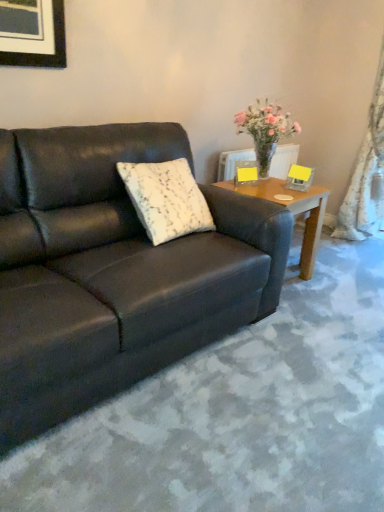
Identify the location of wooden side table at right. (292, 212).

From the picture: From the image's perspective, between white textured pillow at center and wooden side table at right, which one is located above?

white textured pillow at center is shown above in the image.

Is white textured pillow at center not near wooden side table at right?

No.

Is white textured pillow at center behind wooden side table at right?

No, white textured pillow at center is closer to the camera.

Find the location of a particular element. Image resolution: width=384 pixels, height=512 pixels. pillow behind the matte black couch at center is located at coordinates (166, 199).

How many degrees apart are the facing directions of matte black couch at center and white textured pillow at center?

The angular difference between matte black couch at center and white textured pillow at center is 1.56 degrees.

Considering the sizes of matte black couch at center and white textured pillow at center in the image, is matte black couch at center taller or shorter than white textured pillow at center?

Considering their sizes, matte black couch at center has more height than white textured pillow at center.

Is matte black couch at center surrounding white textured pillow at center?

Yes, white textured pillow at center can be found within matte black couch at center.

Measure the distance from matte black couch at center to white lace curtain at right.

matte black couch at center is 2.06 meters from white lace curtain at right.

What's the angular difference between matte black couch at center and white lace curtain at right's facing directions?

The facing directions of matte black couch at center and white lace curtain at right are 89.5 degrees apart.

Considering the sizes of objects matte black couch at center and white lace curtain at right in the image provided, who is wider, matte black couch at center or white lace curtain at right?

matte black couch at center.

Does matte black couch at center have a lesser height compared to white lace curtain at right?

Indeed, matte black couch at center has a lesser height compared to white lace curtain at right.

Which point is more distant from viewer, (198, 238) or (246, 131)?

The point (246, 131) is more distant.

Considering the relative sizes of matte black couch at center and translucent glass vase at upper right in the image provided, is matte black couch at center smaller than translucent glass vase at upper right?

No, matte black couch at center is not smaller than translucent glass vase at upper right.

Does matte black couch at center touch translucent glass vase at upper right?

No, matte black couch at center is not in contact with translucent glass vase at upper right.

Considering the positions of objects matte black couch at center and translucent glass vase at upper right in the image provided, who is more to the right, matte black couch at center or translucent glass vase at upper right?

translucent glass vase at upper right is more to the right.

Is white lace curtain at right positioned beyond the bounds of translucent glass vase at upper right?

Yes, white lace curtain at right is located beyond the bounds of translucent glass vase at upper right.

From the image's perspective, is white lace curtain at right located beneath translucent glass vase at upper right?

Incorrect, from the image's perspective, white lace curtain at right is higher than translucent glass vase at upper right.

How different are the orientations of white lace curtain at right and translucent glass vase at upper right in degrees?

91.9 degrees separate the facing orientations of white lace curtain at right and translucent glass vase at upper right.

Is translucent glass vase at upper right turned away from wooden side table at right?

No, translucent glass vase at upper right is not facing the opposite direction of wooden side table at right.

Considering the relative sizes of translucent glass vase at upper right and wooden side table at right in the image provided, is translucent glass vase at upper right shorter than wooden side table at right?

Yes.

How different are the orientations of translucent glass vase at upper right and wooden side table at right in degrees?

There is a 0.0865-degree angle between the facing directions of translucent glass vase at upper right and wooden side table at right.

Which is less distant, (278, 119) or (311, 260)?

Point (278, 119) is positioned closer to the camera compared to point (311, 260).

Can you confirm if wooden side table at right is positioned to the left of matte black couch at center?

No.

Is wooden side table at right situated inside matte black couch at center or outside?

wooden side table at right is located beyond the bounds of matte black couch at center.

Which of these two, wooden side table at right or matte black couch at center, is smaller?

wooden side table at right.

The width and height of the screenshot is (384, 512). What are the coordinates of `coffee table lying on the right of white textured pillow at center` in the screenshot? It's located at pyautogui.click(x=292, y=212).

Identify the location of pillow above the matte black couch at center (from a real-world perspective). (166, 199).

Looking at the image, which one is located closer to white textured pillow at center, white lace curtain at right or translucent glass vase at upper right?

translucent glass vase at upper right.

Considering their positions, is wooden side table at right positioned closer to translucent glass vase at upper right than white lace curtain at right?

Based on the image, wooden side table at right appears to be nearer to translucent glass vase at upper right.

When comparing their distances from white lace curtain at right, does white textured pillow at center or matte black couch at center seem further?

Based on the image, matte black couch at center appears to be further to white lace curtain at right.

Estimate the real-world distances between objects in this image. Which object is closer to white textured pillow at center, matte black couch at center or white lace curtain at right?

matte black couch at center is positioned closer to the anchor white textured pillow at center.

Which object lies further to the anchor point translucent glass vase at upper right, white textured pillow at center or wooden side table at right?

white textured pillow at center.

Considering their positions, is matte black couch at center positioned further to white lace curtain at right than wooden side table at right?

matte black couch at center is positioned further to the anchor white lace curtain at right.

From the image, which object appears to be nearer to wooden side table at right, translucent glass vase at upper right or white textured pillow at center?

Based on the image, translucent glass vase at upper right appears to be nearer to wooden side table at right.

Looking at the image, which one is located further to white textured pillow at center, translucent glass vase at upper right or wooden side table at right?

Based on the image, translucent glass vase at upper right appears to be further to white textured pillow at center.

At what (x,y) coordinates should I click in order to perform the action: click on coffee table situated between white textured pillow at center and white lace curtain at right from left to right. Please return your answer as a coordinate pair (x, y). Looking at the image, I should click on (292, 212).

Where is `pillow between matte black couch at center and translucent glass vase at upper right along the z-axis`? The image size is (384, 512). pillow between matte black couch at center and translucent glass vase at upper right along the z-axis is located at coordinates (166, 199).

Find the location of `pillow between matte black couch at center and white lace curtain at right from left to right`. pillow between matte black couch at center and white lace curtain at right from left to right is located at coordinates (166, 199).

This screenshot has height=512, width=384. In order to click on houseplant located between matte black couch at center and white lace curtain at right in the left-right direction in this screenshot , I will do `click(265, 130)`.